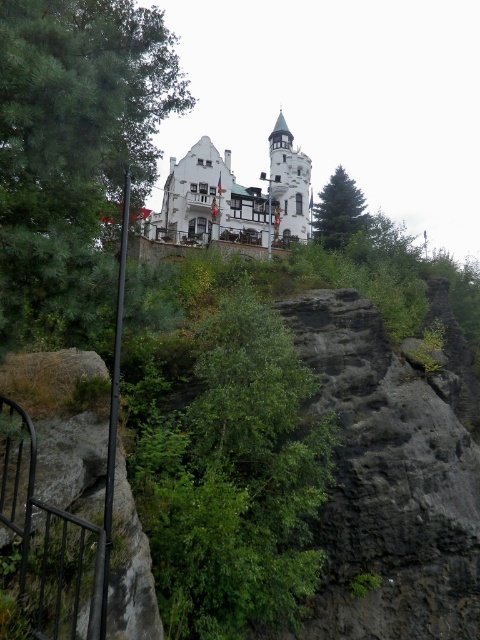
Can you confirm if green leafy tree at left is wider than white stone castle at center?

No, green leafy tree at left is not wider than white stone castle at center.

Between point (50, 179) and point (301, 173), which one is positioned behind?

The point (301, 173) is more distant.

Find the location of a particular element. The height and width of the screenshot is (640, 480). green leafy tree at left is located at coordinates (73, 148).

Measure the distance between white stone castle at center and green matte tree at upper center.

white stone castle at center is 19.95 meters from green matte tree at upper center.

Between point (166, 202) and point (330, 243), which one is positioned behind?

The point (166, 202) is behind.

Where is `white stone castle at center`? Image resolution: width=480 pixels, height=640 pixels. white stone castle at center is located at coordinates (235, 196).

Who is taller, green leafy tree at left or green matte tree at upper center?

Standing taller between the two is green leafy tree at left.

From the picture: Is green leafy tree at left thinner than green matte tree at upper center?

Incorrect, green leafy tree at left's width is not less than green matte tree at upper center's.

The width and height of the screenshot is (480, 640). Identify the location of green leafy tree at left. (73, 148).